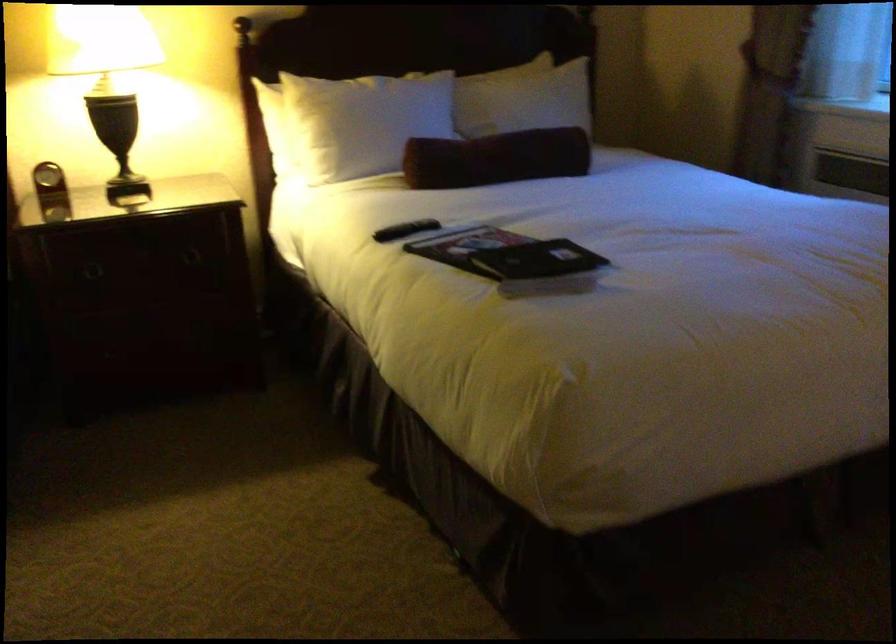
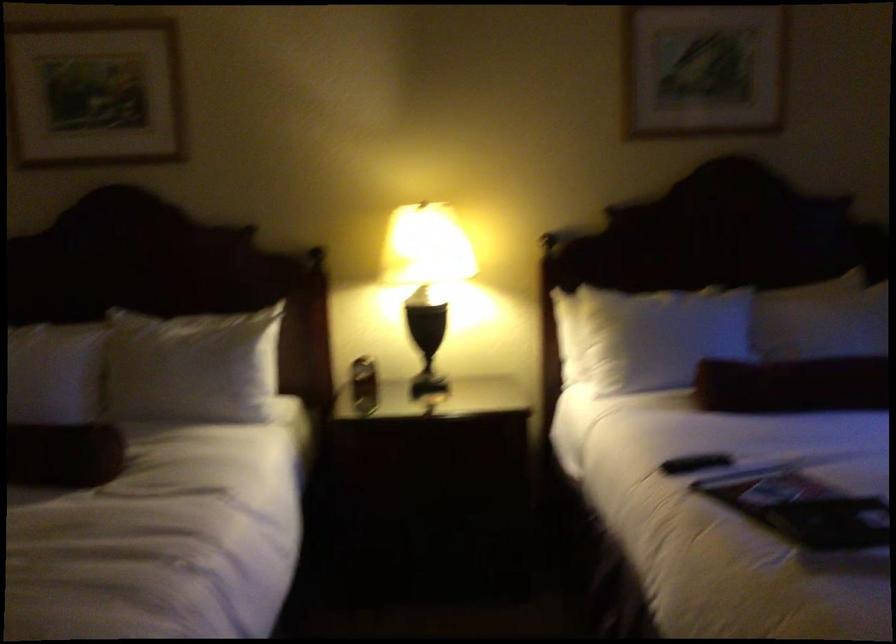
In the second image, find the point that corresponds to (x=401, y=229) in the first image.

(695, 462)